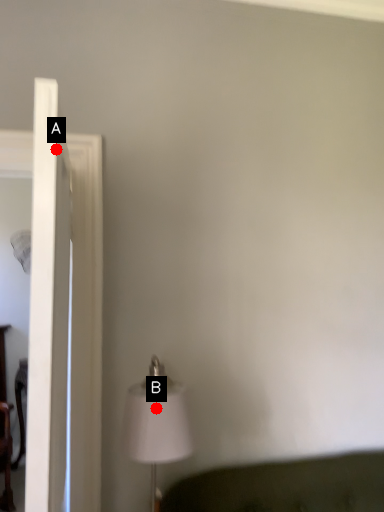
Question: Two points are circled on the image, labeled by A and B beside each circle. Which point is farther to the camera?

Choices:
 (A) A is further
 (B) B is further

Answer: (B)